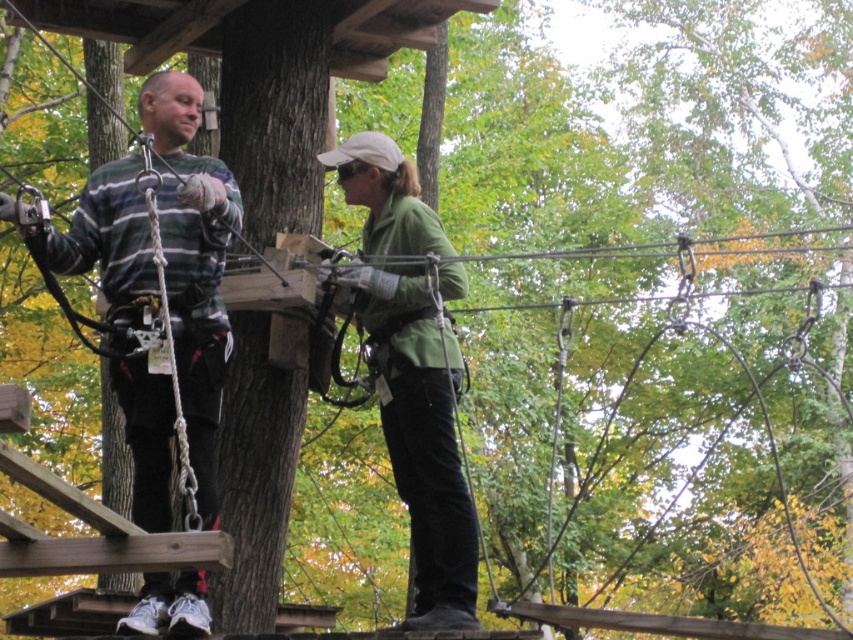
Question: Is striped sweater at left to the right of green matte jacket at center from the viewer's perspective?

Choices:
 (A) yes
 (B) no

Answer: (B)

Question: Can you confirm if striped sweater at left is positioned below green matte jacket at center?

Choices:
 (A) no
 (B) yes

Answer: (A)

Question: Among these points, which one is nearest to the camera?

Choices:
 (A) (207, 243)
 (B) (421, 452)

Answer: (A)

Question: Considering the relative positions of striped sweater at left and green matte jacket at center in the image provided, where is striped sweater at left located with respect to green matte jacket at center?

Choices:
 (A) above
 (B) below

Answer: (A)